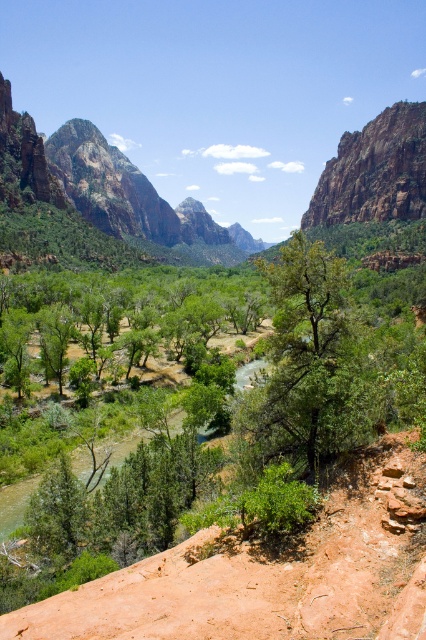
Question: Based on their relative distances, which object is farther from the green matte tree at center?

Choices:
 (A) rustic rock cliff at upper right
 (B) green leafy trees at center

Answer: (A)

Question: Considering the real-world distances, which object is closest to the rustic rock cliff at upper right?

Choices:
 (A) green matte tree at center
 (B) green leafy trees at center

Answer: (B)

Question: Does green matte tree at center appear over green leafy trees at center?

Choices:
 (A) yes
 (B) no

Answer: (B)

Question: Observing the image, what is the correct spatial positioning of green leafy trees at center in reference to rustic rock cliff at upper right?

Choices:
 (A) above
 (B) below

Answer: (B)

Question: Is green matte tree at center positioned before rustic rock cliff at upper right?

Choices:
 (A) yes
 (B) no

Answer: (A)

Question: Which object is positioned farthest from the green leafy trees at center?

Choices:
 (A) green matte tree at center
 (B) rustic rock cliff at upper right

Answer: (B)